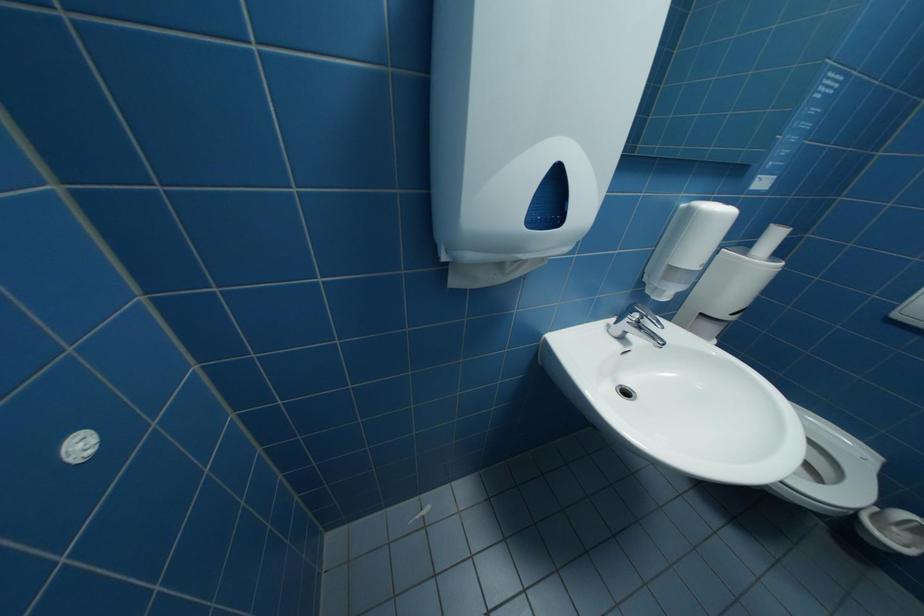
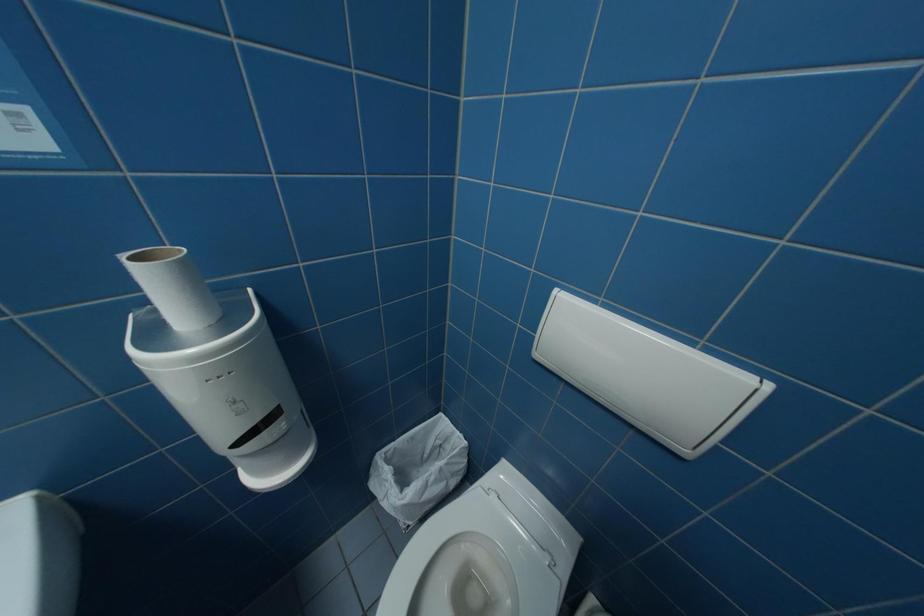
Question: In a continuous first-person perspective shot, in which direction is the camera moving?

Choices:
 (A) Left
 (B) Right
 (C) Forward
 (D) Backward

Answer: (B)